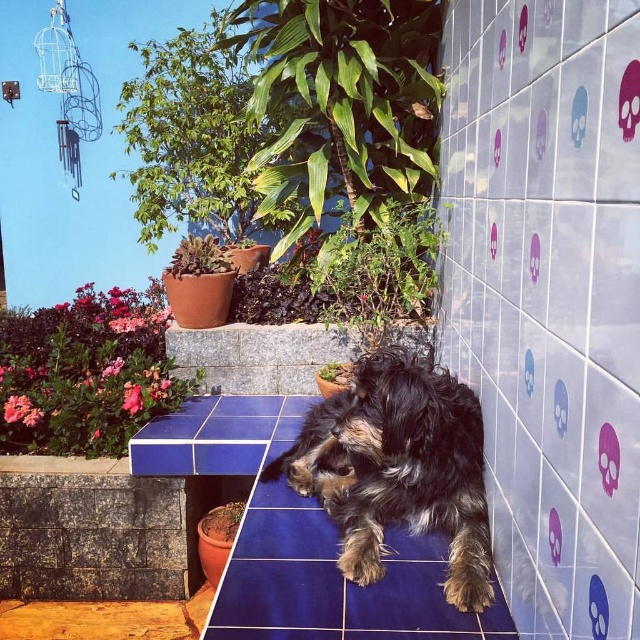
Question: Which of the following is the closest to the observer?

Choices:
 (A) (632, 358)
 (B) (342, 500)

Answer: (A)

Question: Is white glossy tile at center right bigger than fuzzy brown dog at center?

Choices:
 (A) yes
 (B) no

Answer: (A)

Question: Among these points, which one is farthest from the camera?

Choices:
 (A) coord(496,266)
 (B) coord(465,419)

Answer: (B)

Question: In this image, where is white glossy tile at center right located relative to fuzzy brown dog at center?

Choices:
 (A) right
 (B) left

Answer: (A)

Question: Which object is farther from the camera taking this photo?

Choices:
 (A) white glossy tile at center right
 (B) fuzzy brown dog at center

Answer: (B)

Question: Does white glossy tile at center right appear on the left side of fuzzy brown dog at center?

Choices:
 (A) no
 (B) yes

Answer: (A)